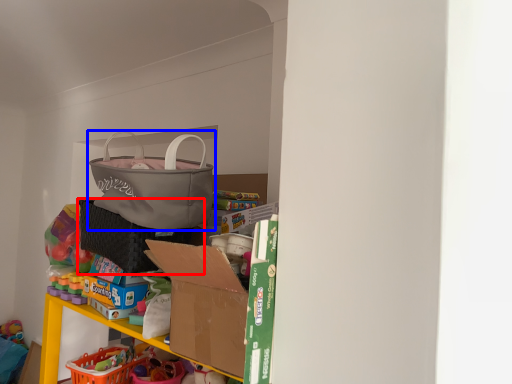
Question: Which point is further to the camera, laundry basket (highlighted by a red box) or handbag (highlighted by a blue box)?

Choices:
 (A) laundry basket
 (B) handbag

Answer: (A)